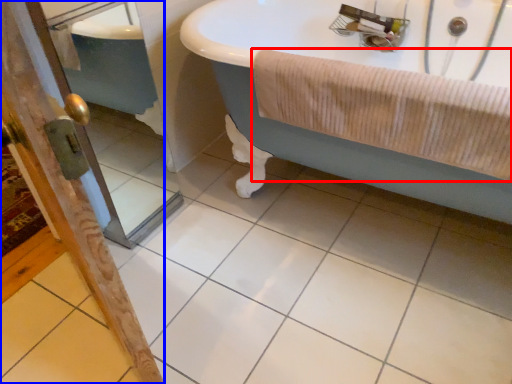
Question: Which of the following is the farthest to the observer, bath towel (highlighted by a red box) or screen door (highlighted by a blue box)?

Choices:
 (A) bath towel
 (B) screen door

Answer: (B)